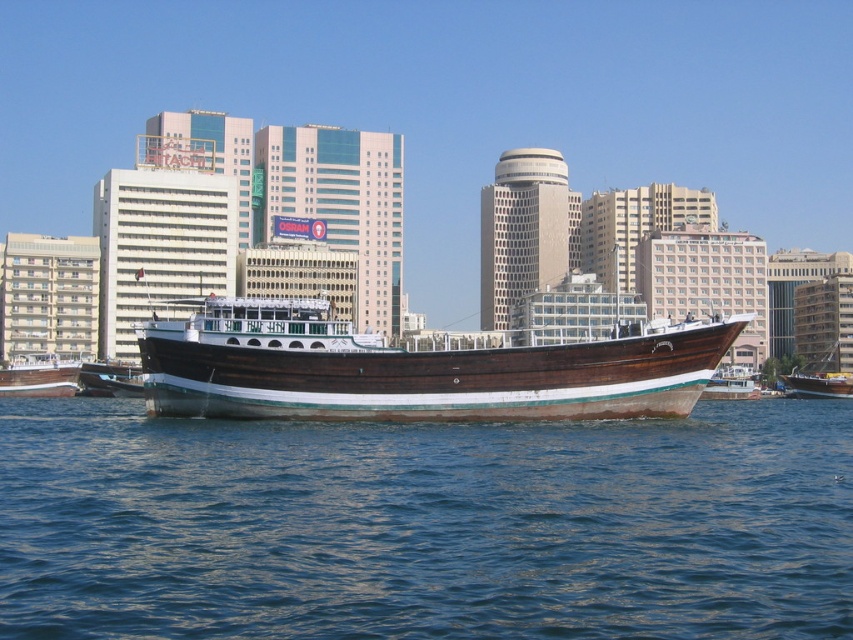
You are standing on the deck of the traditional wooden boat and want to locate the blue water at center. According to the coordinates provided, where exactly would you look?

The blue water at center is located at coordinates point (425, 525).